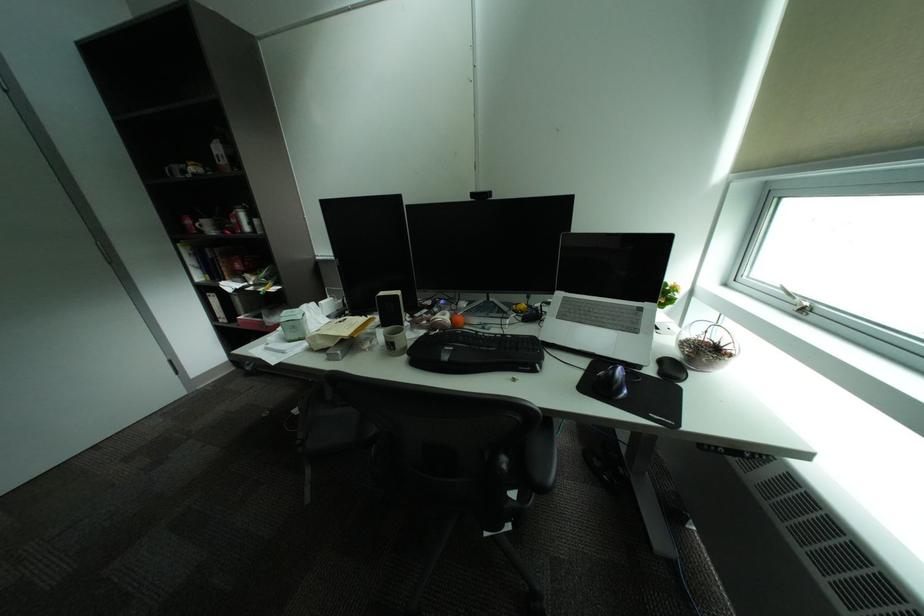
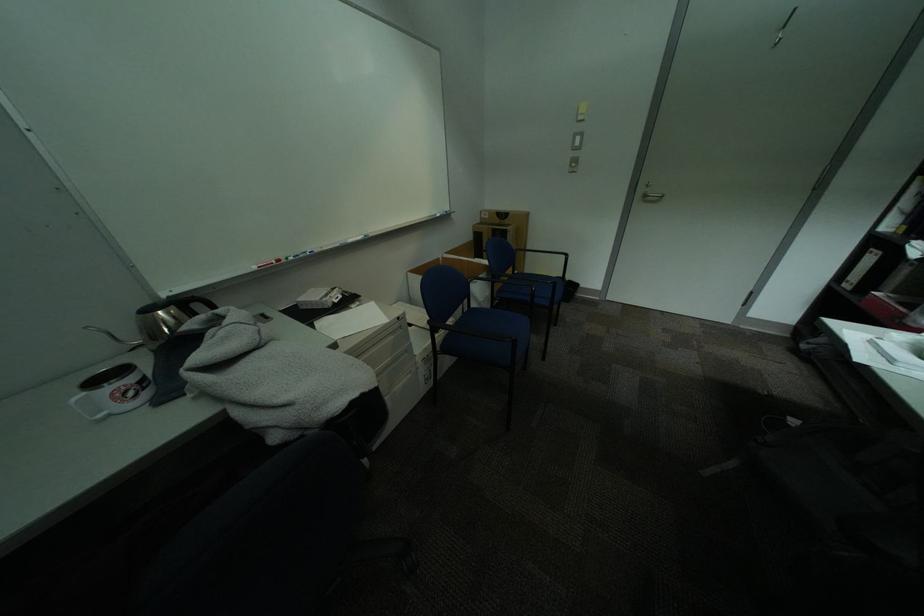
Find the pixel in the second image that matches (229,317) in the first image.

(859, 280)